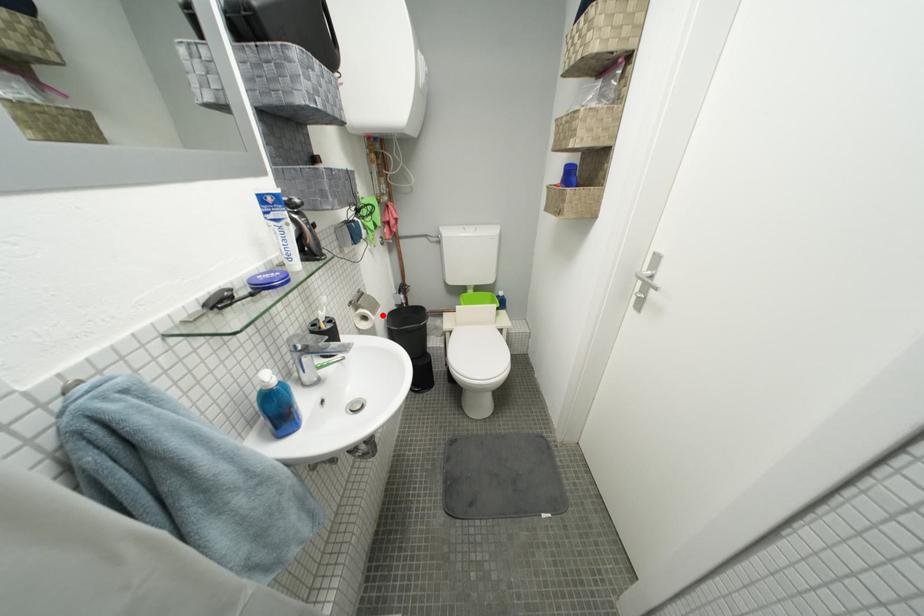
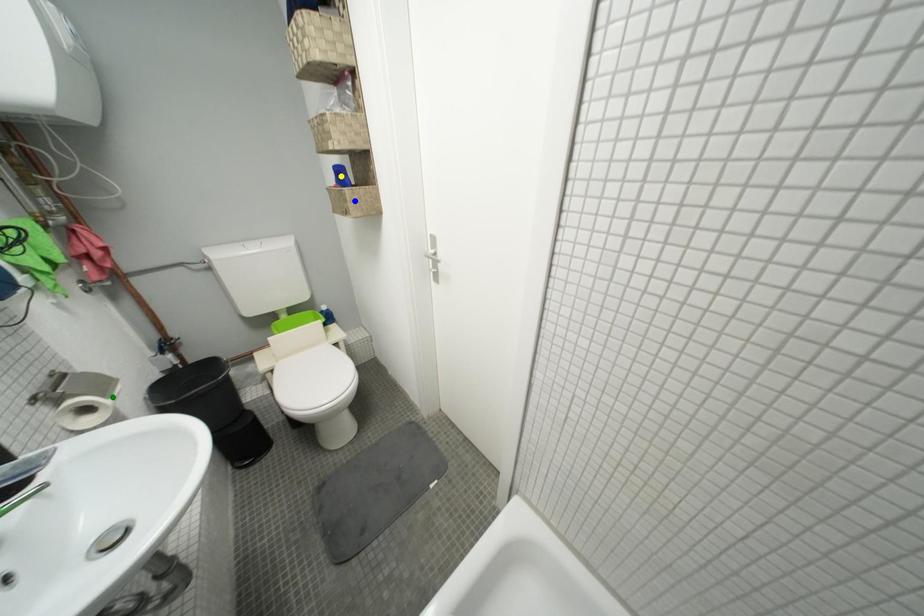
Question: I am providing you with two images of the same scene from different viewpoints. A red point is marked on the first image. You are given multiple points on the second image. Can you choose the point in image 2 that corresponds to the point in image 1?

Choices:
 (A) green point
 (B) blue point
 (C) yellow point

Answer: (A)